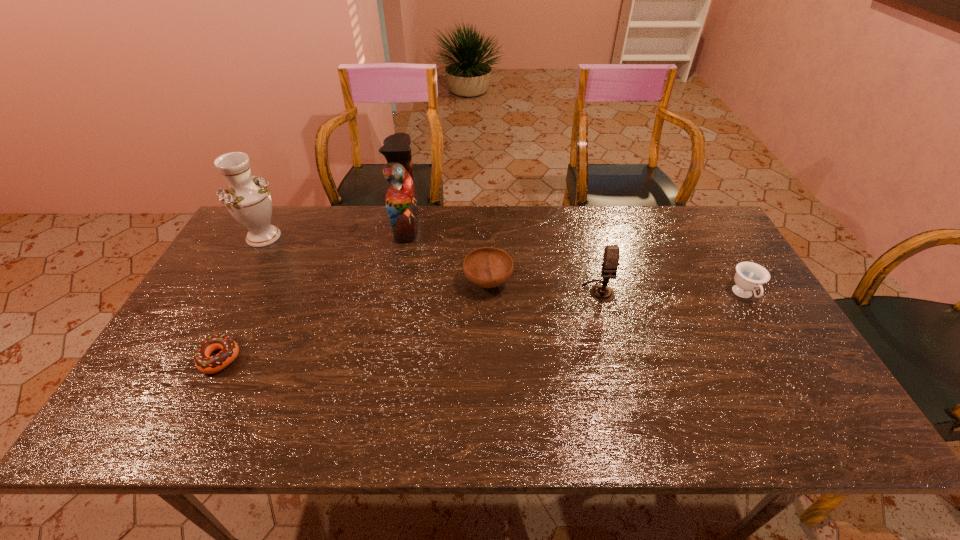
What are the coordinates of `vacant space in between the doughnut and the fourth object from left to right` in the screenshot? It's located at (353, 320).

You are a GUI agent. You are given a task and a screenshot of the screen. Output one action in this format:
    pyautogui.click(x=<x>, y=<y>)
    Task: Click on the free space that is in between the nearest object and the microphone
    The width and height of the screenshot is (960, 540).
    Given the screenshot: What is the action you would take?
    pyautogui.click(x=409, y=325)

Identify the location of free space between the bowl and the parrot. (446, 253).

Identify the location of vacant space that's between the teacup and the microphone. The image size is (960, 540). (671, 293).

At what (x,y) coordinates should I click in order to perform the action: click on empty space that is in between the doughnut and the vase. Please return your answer as a coordinate pair (x, y). Image resolution: width=960 pixels, height=540 pixels. Looking at the image, I should click on (241, 298).

Select which object is the fifth closest to the doughnut. Please provide its 2D coordinates. Your answer should be formatted as a tuple, i.e. [(x, y)], where the tuple contains the x and y coordinates of a point satisfying the conditions above.

[(749, 276)]

Find the location of `object that is the second closest to the vase`. object that is the second closest to the vase is located at coordinates (204, 363).

Find the location of `vacant region that satisfies the following two spatial constraints: 1. on the back side of the bowl; 2. at the face of the fourth object from right to left`. vacant region that satisfies the following two spatial constraints: 1. on the back side of the bowl; 2. at the face of the fourth object from right to left is located at coordinates click(x=487, y=225).

Where is `free location that satisfies the following two spatial constraints: 1. at the face of the parrot; 2. on the left side of the third object from right to left`? free location that satisfies the following two spatial constraints: 1. at the face of the parrot; 2. on the left side of the third object from right to left is located at coordinates (395, 282).